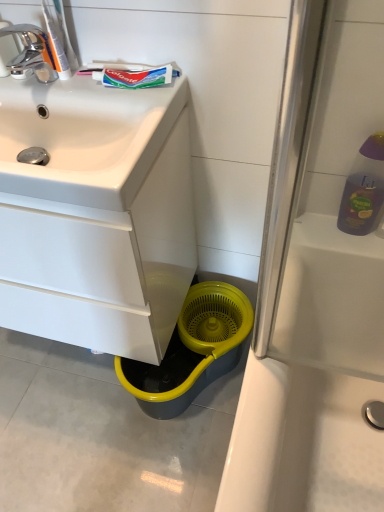
Question: Considering the relative positions of white matte toothpaste at upper left, the first toothpaste in the left-to-right sequence, and white glossy sink at upper left in the image provided, is white matte toothpaste at upper left, the first toothpaste in the left-to-right sequence, to the right of white glossy sink at upper left from the viewer's perspective?

Choices:
 (A) yes
 (B) no

Answer: (A)

Question: Considering the relative positions of white matte toothpaste at upper left, the second toothpaste viewed from the right, and white glossy sink at upper left in the image provided, is white matte toothpaste at upper left, the second toothpaste viewed from the right, to the left of white glossy sink at upper left from the viewer's perspective?

Choices:
 (A) no
 (B) yes

Answer: (A)

Question: Is white matte toothpaste at upper left, the second toothpaste viewed from the right, not within white glossy sink at upper left?

Choices:
 (A) no
 (B) yes

Answer: (B)

Question: Is white matte toothpaste at upper left, the first toothpaste in the left-to-right sequence, taller than white glossy sink at upper left?

Choices:
 (A) no
 (B) yes

Answer: (A)

Question: Is white matte toothpaste at upper left, the first toothpaste in the left-to-right sequence, wider than white glossy sink at upper left?

Choices:
 (A) no
 (B) yes

Answer: (A)

Question: Is white matte toothpaste at upper left, the second toothpaste viewed from the right, further to the viewer compared to white glossy sink at upper left?

Choices:
 (A) yes
 (B) no

Answer: (A)

Question: Considering the relative sizes of colgate toothpaste at upper left, arranged as the second toothpaste when viewed from the left, and white matte toothpaste at upper left, the first toothpaste in the left-to-right sequence, in the image provided, is colgate toothpaste at upper left, arranged as the second toothpaste when viewed from the left, shorter than white matte toothpaste at upper left, the first toothpaste in the left-to-right sequence,?

Choices:
 (A) no
 (B) yes

Answer: (B)

Question: Can you confirm if colgate toothpaste at upper left, arranged as the second toothpaste when viewed from the left, is bigger than white matte toothpaste at upper left, the second toothpaste viewed from the right?

Choices:
 (A) yes
 (B) no

Answer: (A)

Question: Could white matte toothpaste at upper left, the first toothpaste in the left-to-right sequence, be considered to be inside colgate toothpaste at upper left, arranged as the second toothpaste when viewed from the left?

Choices:
 (A) yes
 (B) no

Answer: (B)

Question: From the image's perspective, is colgate toothpaste at upper left, which is counted as the 1th toothpaste, starting from the right, located above white matte toothpaste at upper left, the second toothpaste viewed from the right?

Choices:
 (A) no
 (B) yes

Answer: (A)

Question: Is colgate toothpaste at upper left, which is counted as the 1th toothpaste, starting from the right, in front of white matte toothpaste at upper left, the first toothpaste in the left-to-right sequence?

Choices:
 (A) yes
 (B) no

Answer: (B)

Question: From a real-world perspective, is colgate toothpaste at upper left, which is counted as the 1th toothpaste, starting from the right, physically above white matte toothpaste at upper left, the first toothpaste in the left-to-right sequence?

Choices:
 (A) yes
 (B) no

Answer: (B)

Question: From a real-world perspective, is chrome/metallic faucet at upper left on white glossy cabinet at lower left?

Choices:
 (A) no
 (B) yes

Answer: (B)